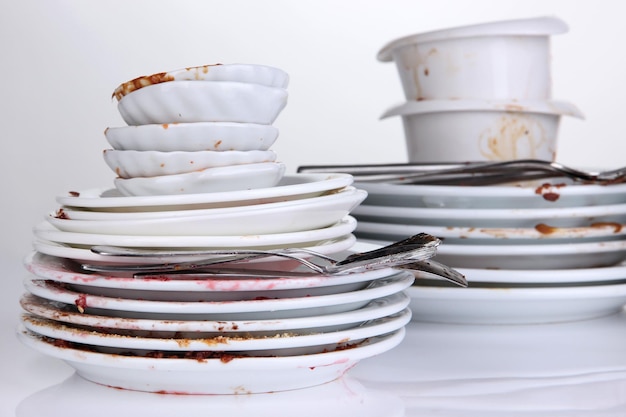
Where is `dirty bowls`? This screenshot has width=626, height=417. dirty bowls is located at coordinates (188, 186), (168, 163), (176, 139), (190, 107), (226, 67).